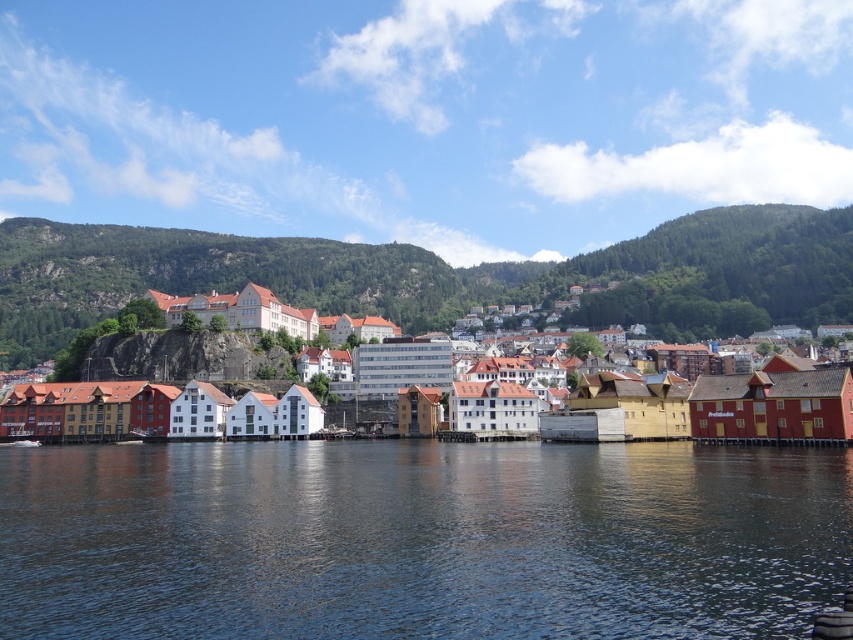
Is transparent water at center in front of white wooden buildings at center?

Yes, it is in front of white wooden buildings at center.

Which is more to the left, transparent water at center or white wooden buildings at center?

Positioned to the left is transparent water at center.

Which is in front, point (80, 456) or point (846, 413)?

Point (846, 413) is in front.

This screenshot has width=853, height=640. I want to click on transparent water at center, so click(421, 540).

Is green forested mountain at upper center to the left of white wooden buildings at center from the viewer's perspective?

Indeed, green forested mountain at upper center is positioned on the left side of white wooden buildings at center.

Who is more distant from viewer, (12, 241) or (821, 387)?

The point (12, 241) is more distant.

Is point (733, 328) less distant than point (430, 374)?

No, it is not.

Where is `green forested mountain at upper center`? green forested mountain at upper center is located at coordinates pos(438,275).

Can you confirm if transparent water at center is bigger than green forested mountain at upper center?

No, transparent water at center is not bigger than green forested mountain at upper center.

Can you confirm if transparent water at center is positioned below green forested mountain at upper center?

Yes, transparent water at center is below green forested mountain at upper center.

Describe the element at coordinates (421, 540) in the screenshot. I see `transparent water at center` at that location.

The image size is (853, 640). I want to click on transparent water at center, so click(x=421, y=540).